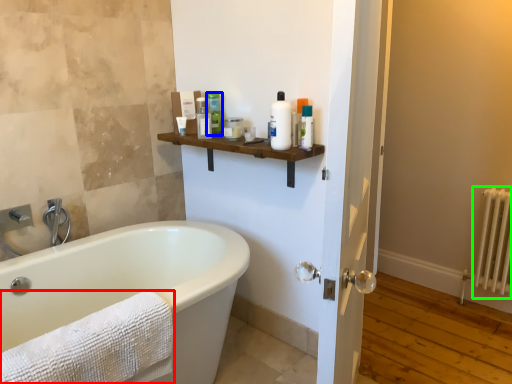
Question: Considering the real-world distances, which object is closest to towel (highlighted by a red box)? toiletry (highlighted by a blue box) or radiator (highlighted by a green box).

Choices:
 (A) toiletry
 (B) radiator

Answer: (A)